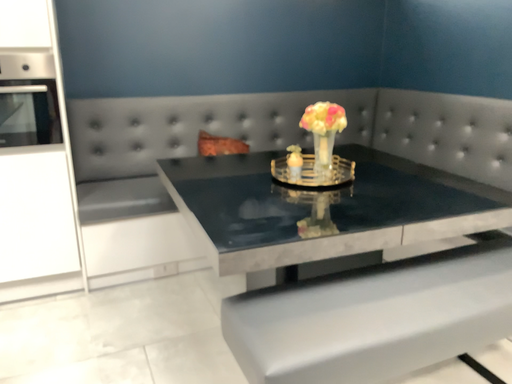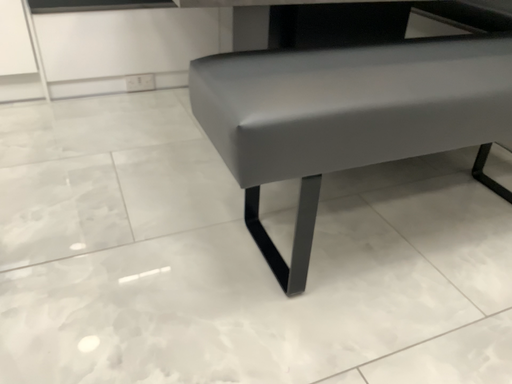
Question: How did the camera likely rotate when shooting the video?

Choices:
 (A) rotated downward
 (B) rotated upward

Answer: (A)